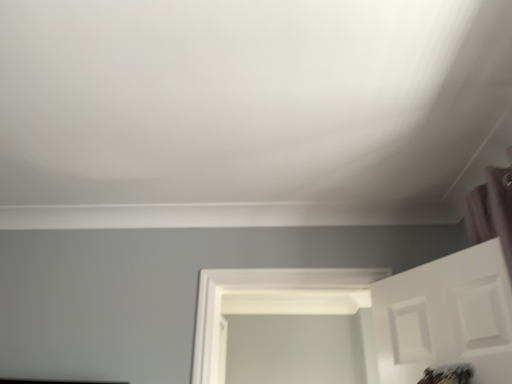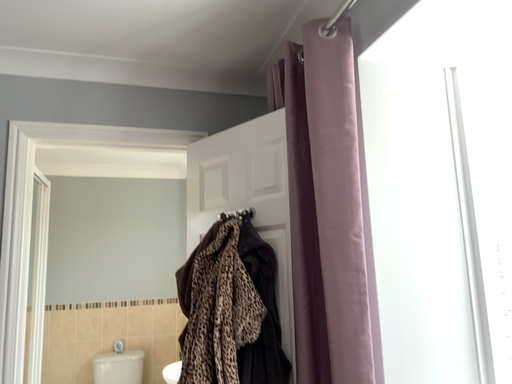
Question: How did the camera likely rotate when shooting the video?

Choices:
 (A) rotated downward
 (B) rotated upward

Answer: (A)